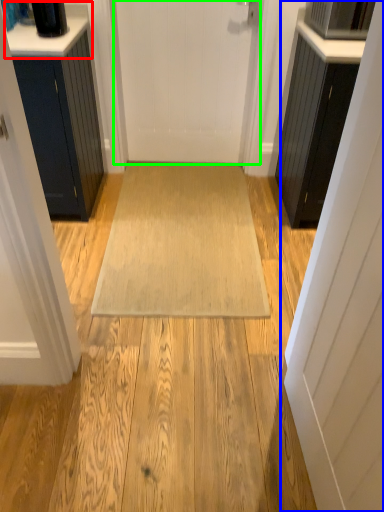
Question: Which object is positioned farthest from counter top (highlighted by a red box)? Select from door (highlighted by a blue box) and door (highlighted by a green box).

Choices:
 (A) door
 (B) door

Answer: (A)